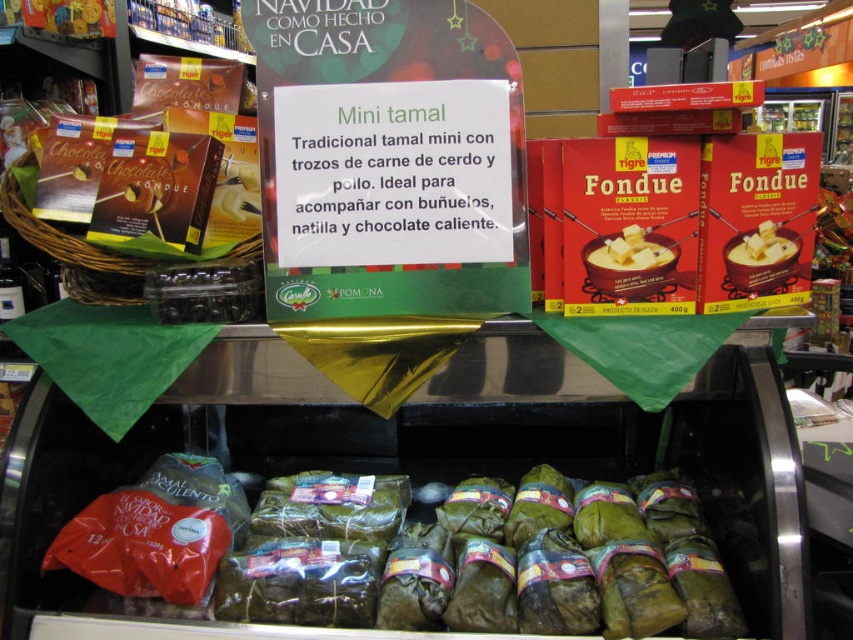
Is white creamy cheese at center to the right of smooth white cheese at center from the viewer's perspective?

Incorrect, white creamy cheese at center is not on the right side of smooth white cheese at center.

Does white creamy cheese at center have a lesser width compared to smooth white cheese at center?

No.

Is point (602, 236) farther from viewer compared to point (779, 257)?

No, it is not.

Locate an element on the screen. Image resolution: width=853 pixels, height=640 pixels. white creamy cheese at center is located at coordinates (630, 250).

What do you see at coordinates (416, 556) in the screenshot?
I see `green leafy wrapped at lower center` at bounding box center [416, 556].

Does green leafy wrapped at lower center have a larger size compared to smooth white cheese at center?

Yes, green leafy wrapped at lower center is bigger than smooth white cheese at center.

This screenshot has height=640, width=853. I want to click on green leafy wrapped at lower center, so click(x=416, y=556).

Which of these two, green leafy wrapped at lower center or white creamy cheese at center, stands shorter?

With less height is white creamy cheese at center.

Can you confirm if green leafy wrapped at lower center is positioned above white creamy cheese at center?

No.

Between point (465, 554) and point (660, 250), which one is positioned in front?

Point (660, 250) is in front.

Where is `green leafy wrapped at lower center`? green leafy wrapped at lower center is located at coordinates (416, 556).